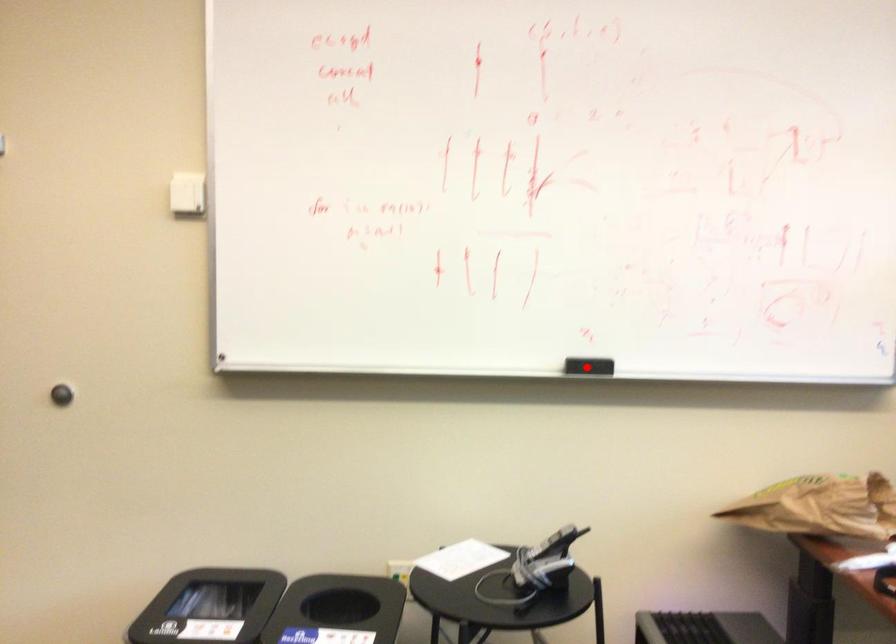
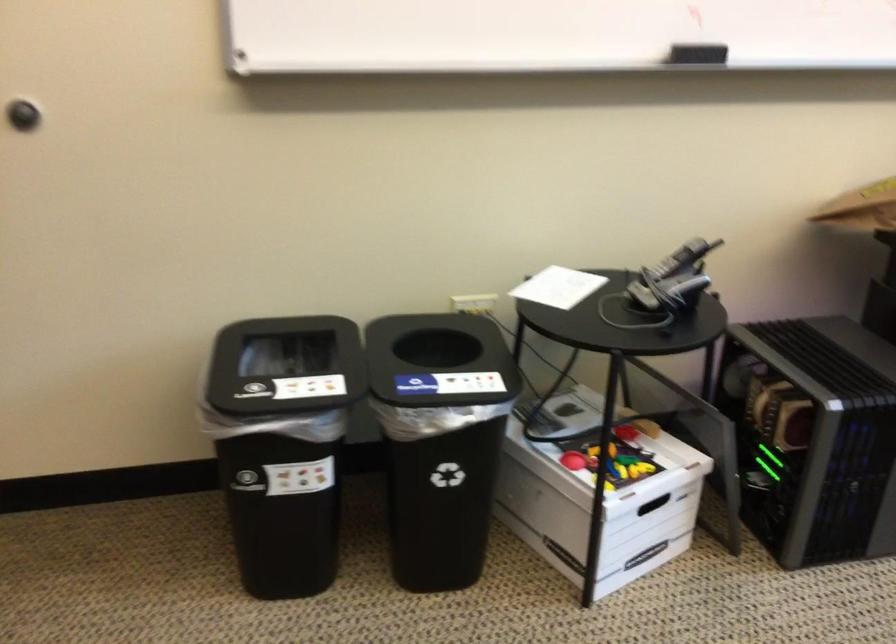
Locate, in the second image, the point that corresponds to the highlighted location in the first image.

(696, 53)